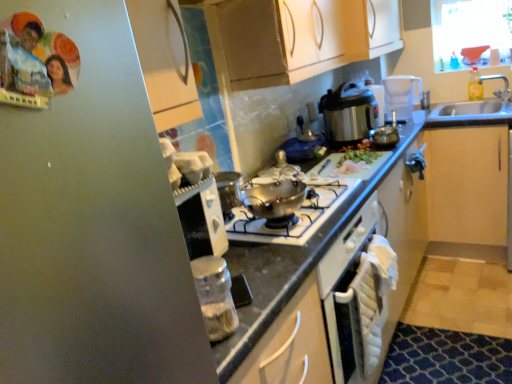
Where is `spots to the right of clear glass jar at lower center, the second kitchen appliance from the right`? This screenshot has width=512, height=384. spots to the right of clear glass jar at lower center, the second kitchen appliance from the right is located at coordinates (263, 306).